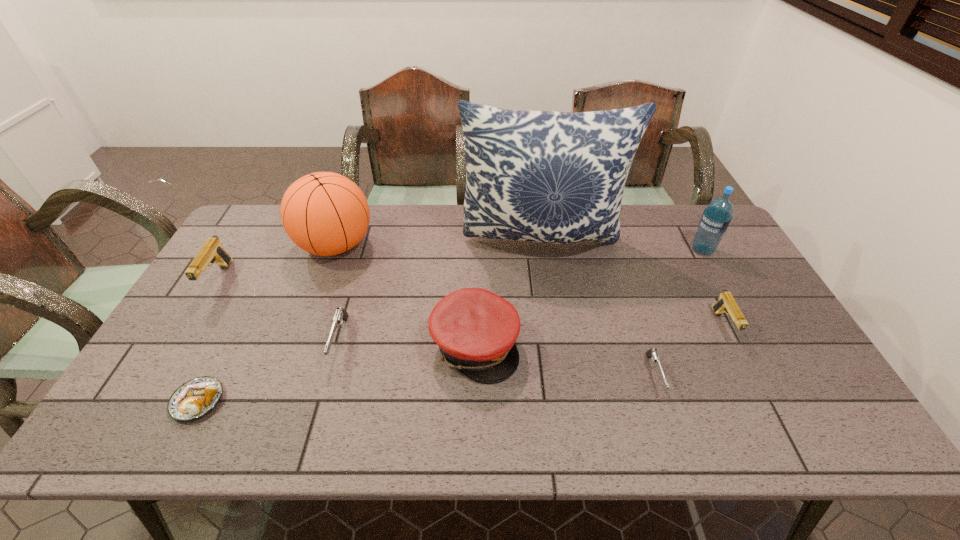
This screenshot has height=540, width=960. What are the coordinates of `free space located 0.050m on the front-facing side of the red cap` in the screenshot? It's located at (538, 346).

Identify the location of free location located at the barrel of the right tan pistol. (750, 378).

Locate an element on the screen. The width and height of the screenshot is (960, 540). free space located 0.060m on the front-facing side of the third shortest object is located at coordinates (325, 390).

At what (x,y) coordinates should I click in order to perform the action: click on free region located 0.320m on the right of the shortest object. Please return your answer as a coordinate pair (x, y). The width and height of the screenshot is (960, 540). Looking at the image, I should click on (358, 401).

I want to click on cushion situated at the far edge, so click(554, 177).

Where is `basketball that is positioned at the far edge`? basketball that is positioned at the far edge is located at coordinates (324, 213).

Find the location of a particular element. water bottle that is at the far edge is located at coordinates (716, 218).

Image resolution: width=960 pixels, height=540 pixels. Identify the location of object at the near edge. (195, 398).

This screenshot has width=960, height=540. In order to click on pistol that is at the left edge in this screenshot , I will do `click(212, 251)`.

Identify the location of pastry located in the left edge section of the desktop. (195, 398).